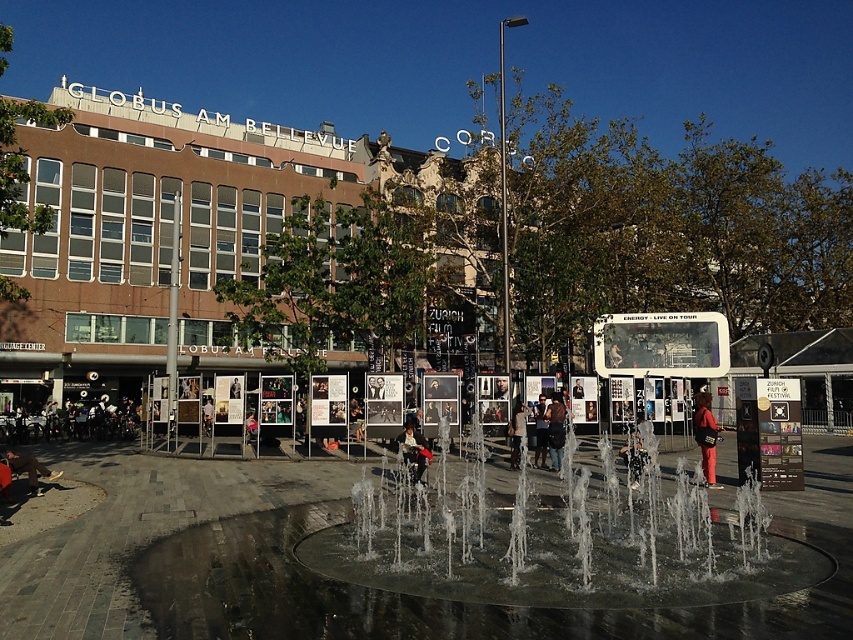
Is point (509, 451) behind point (543, 436)?

Yes, it is.

I want to click on matte black jacket at center, so click(x=515, y=433).

Locate an element on the screen. This screenshot has height=640, width=853. matte black jacket at center is located at coordinates (515, 433).

Who is lower down, denim jacket at center or dark brown leather jacket at center?

dark brown leather jacket at center is lower down.

Can you confirm if denim jacket at center is positioned above dark brown leather jacket at center?

Yes, denim jacket at center is above dark brown leather jacket at center.

Locate an element on the screen. denim jacket at center is located at coordinates (555, 429).

The width and height of the screenshot is (853, 640). I want to click on denim jacket at center, so click(555, 429).

Is dark blue jeans at center below brown leather jacket at lower left?

Yes, dark blue jeans at center is below brown leather jacket at lower left.

Is point (26, 433) positioned behind point (12, 468)?

Yes, point (26, 433) is behind point (12, 468).

Where is `dark blue jeans at center`? The width and height of the screenshot is (853, 640). dark blue jeans at center is located at coordinates (71, 422).